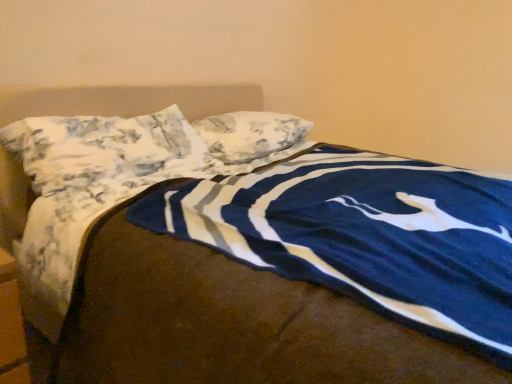
In order to click on floral fabric pillow at upper center, the second pillow viewed from the back in this screenshot , I will do `click(103, 148)`.

What do you see at coordinates (103, 148) in the screenshot? I see `floral fabric pillow at upper center, the second pillow viewed from the back` at bounding box center [103, 148].

Measure the distance between floral fabric pillow at center, the 1th pillow in the back-to-front sequence, and camera.

floral fabric pillow at center, the 1th pillow in the back-to-front sequence, is 1.71 meters away from camera.

In order to face floral fabric pillow at center, arranged as the 2th pillow when viewed from the front, should I rotate leftwards or rightwards?

A 0.360 degree turn to the left will do.

This screenshot has width=512, height=384. What do you see at coordinates (250, 134) in the screenshot? I see `floral fabric pillow at center, arranged as the 2th pillow when viewed from the front` at bounding box center [250, 134].

Where is `floral fabric pillow at center, arranged as the 2th pillow when viewed from the front`? This screenshot has width=512, height=384. floral fabric pillow at center, arranged as the 2th pillow when viewed from the front is located at coordinates (250, 134).

Where is `floral fabric pillow at upper center, which is the first pillow in front-to-back order`? This screenshot has width=512, height=384. floral fabric pillow at upper center, which is the first pillow in front-to-back order is located at coordinates point(103,148).

Which is more to the right, floral fabric pillow at center, arranged as the 2th pillow when viewed from the front, or floral fabric pillow at upper center, which is the first pillow in front-to-back order?

Positioned to the right is floral fabric pillow at center, arranged as the 2th pillow when viewed from the front.

Which object is further away from the camera, floral fabric pillow at center, the 1th pillow in the back-to-front sequence, or floral fabric pillow at upper center, the second pillow viewed from the back?

Positioned behind is floral fabric pillow at center, the 1th pillow in the back-to-front sequence.

Is point (267, 127) closer or farther from the camera than point (108, 143)?

Point (267, 127) is farther from the camera than point (108, 143).

From the image's perspective, is floral fabric pillow at center, arranged as the 2th pillow when viewed from the front, above floral fabric pillow at upper center, which is the first pillow in front-to-back order?

Correct, floral fabric pillow at center, arranged as the 2th pillow when viewed from the front, appears higher than floral fabric pillow at upper center, which is the first pillow in front-to-back order, in the image.

From a real-world perspective, is floral fabric pillow at center, arranged as the 2th pillow when viewed from the front, on floral fabric pillow at upper center, the second pillow viewed from the back?

Actually, floral fabric pillow at center, arranged as the 2th pillow when viewed from the front, is physically below floral fabric pillow at upper center, the second pillow viewed from the back, in the real world.

Between floral fabric pillow at center, arranged as the 2th pillow when viewed from the front, and floral fabric pillow at upper center, the second pillow viewed from the back, which one has smaller width?

floral fabric pillow at center, arranged as the 2th pillow when viewed from the front, is thinner.

Looking at this image, considering the relative sizes of floral fabric pillow at center, the 1th pillow in the back-to-front sequence, and floral fabric pillow at upper center, the second pillow viewed from the back, in the image provided, is floral fabric pillow at center, the 1th pillow in the back-to-front sequence, taller than floral fabric pillow at upper center, the second pillow viewed from the back,?

Incorrect, the height of floral fabric pillow at center, the 1th pillow in the back-to-front sequence, is not larger of that of floral fabric pillow at upper center, the second pillow viewed from the back.

Looking at the image, does floral fabric pillow at center, the 1th pillow in the back-to-front sequence, seem bigger or smaller compared to floral fabric pillow at upper center, which is the first pillow in front-to-back order?

Clearly, floral fabric pillow at center, the 1th pillow in the back-to-front sequence, is smaller in size than floral fabric pillow at upper center, which is the first pillow in front-to-back order.

Is floral fabric pillow at upper center, which is the first pillow in front-to-back order, a part of floral fabric pillow at center, the 1th pillow in the back-to-front sequence?

No, floral fabric pillow at upper center, which is the first pillow in front-to-back order, is located outside of floral fabric pillow at center, the 1th pillow in the back-to-front sequence.

Is floral fabric pillow at center, arranged as the 2th pillow when viewed from the front, beside floral fabric pillow at upper center, which is the first pillow in front-to-back order?

No, floral fabric pillow at center, arranged as the 2th pillow when viewed from the front, is not with floral fabric pillow at upper center, which is the first pillow in front-to-back order.

Is floral fabric pillow at center, the 1th pillow in the back-to-front sequence, facing away from floral fabric pillow at upper center, the second pillow viewed from the back?

That's not correct — floral fabric pillow at center, the 1th pillow in the back-to-front sequence, is not looking away from floral fabric pillow at upper center, the second pillow viewed from the back.

How many degrees apart are the facing directions of floral fabric pillow at center, arranged as the 2th pillow when viewed from the front, and floral fabric pillow at upper center, which is the first pillow in front-to-back order?

The angle between the facing direction of floral fabric pillow at center, arranged as the 2th pillow when viewed from the front, and the facing direction of floral fabric pillow at upper center, which is the first pillow in front-to-back order, is 2.42 degrees.

Could you measure the distance between floral fabric pillow at center, the 1th pillow in the back-to-front sequence, and floral fabric pillow at upper center, the second pillow viewed from the back?

floral fabric pillow at center, the 1th pillow in the back-to-front sequence, is 14.10 inches away from floral fabric pillow at upper center, the second pillow viewed from the back.

Image resolution: width=512 pixels, height=384 pixels. I want to click on pillow above the floral fabric pillow at upper center, the second pillow viewed from the back (from the image's perspective), so point(250,134).

Based on their positions, is floral fabric pillow at upper center, which is the first pillow in front-to-back order, located to the left or right of floral fabric pillow at center, the 1th pillow in the back-to-front sequence?

From the image, it's evident that floral fabric pillow at upper center, which is the first pillow in front-to-back order, is to the left of floral fabric pillow at center, the 1th pillow in the back-to-front sequence.

Between floral fabric pillow at upper center, which is the first pillow in front-to-back order, and floral fabric pillow at center, arranged as the 2th pillow when viewed from the front, which one is positioned behind?

floral fabric pillow at center, arranged as the 2th pillow when viewed from the front, is further from the camera.

Between point (98, 158) and point (241, 129), which one is positioned in front?

The point (98, 158) is in front.

From the image's perspective, which one is positioned lower, floral fabric pillow at upper center, the second pillow viewed from the back, or floral fabric pillow at center, arranged as the 2th pillow when viewed from the front?

floral fabric pillow at upper center, the second pillow viewed from the back, from the image's perspective.

From a real-world perspective, which object stands above the other?

floral fabric pillow at upper center, the second pillow viewed from the back.

Does floral fabric pillow at upper center, which is the first pillow in front-to-back order, have a lesser width compared to floral fabric pillow at center, arranged as the 2th pillow when viewed from the front?

Incorrect, the width of floral fabric pillow at upper center, which is the first pillow in front-to-back order, is not less than that of floral fabric pillow at center, arranged as the 2th pillow when viewed from the front.

Who is taller, floral fabric pillow at upper center, the second pillow viewed from the back, or floral fabric pillow at center, arranged as the 2th pillow when viewed from the front?

floral fabric pillow at upper center, the second pillow viewed from the back, is taller.

Between floral fabric pillow at upper center, the second pillow viewed from the back, and floral fabric pillow at center, the 1th pillow in the back-to-front sequence, which one has smaller size?

Smaller between the two is floral fabric pillow at center, the 1th pillow in the back-to-front sequence.

Is floral fabric pillow at upper center, the second pillow viewed from the back, not within floral fabric pillow at center, the 1th pillow in the back-to-front sequence?

Yes, floral fabric pillow at upper center, the second pillow viewed from the back, is located beyond the bounds of floral fabric pillow at center, the 1th pillow in the back-to-front sequence.

Is floral fabric pillow at upper center, the second pillow viewed from the back, far from floral fabric pillow at center, arranged as the 2th pillow when viewed from the front?

That's not correct — floral fabric pillow at upper center, the second pillow viewed from the back, is a little close to floral fabric pillow at center, arranged as the 2th pillow when viewed from the front.

Is floral fabric pillow at center, the 1th pillow in the back-to-front sequence, at the back of floral fabric pillow at upper center, the second pillow viewed from the back?

No, floral fabric pillow at upper center, the second pillow viewed from the back, is not facing away from floral fabric pillow at center, the 1th pillow in the back-to-front sequence.

Find the location of a particular element. This screenshot has height=384, width=512. pillow that appears below the floral fabric pillow at center, the 1th pillow in the back-to-front sequence (from the image's perspective) is located at coordinates (103, 148).

You are a GUI agent. You are given a task and a screenshot of the screen. Output one action in this format:
    pyautogui.click(x=<x>, y=<y>)
    Task: Click on the pillow that appears in front of the floral fabric pillow at center, the 1th pillow in the back-to-front sequence
    The image size is (512, 384).
    Given the screenshot: What is the action you would take?
    pyautogui.click(x=103, y=148)

Identify the location of pillow that is on the right side of floral fabric pillow at upper center, the second pillow viewed from the back. (250, 134).